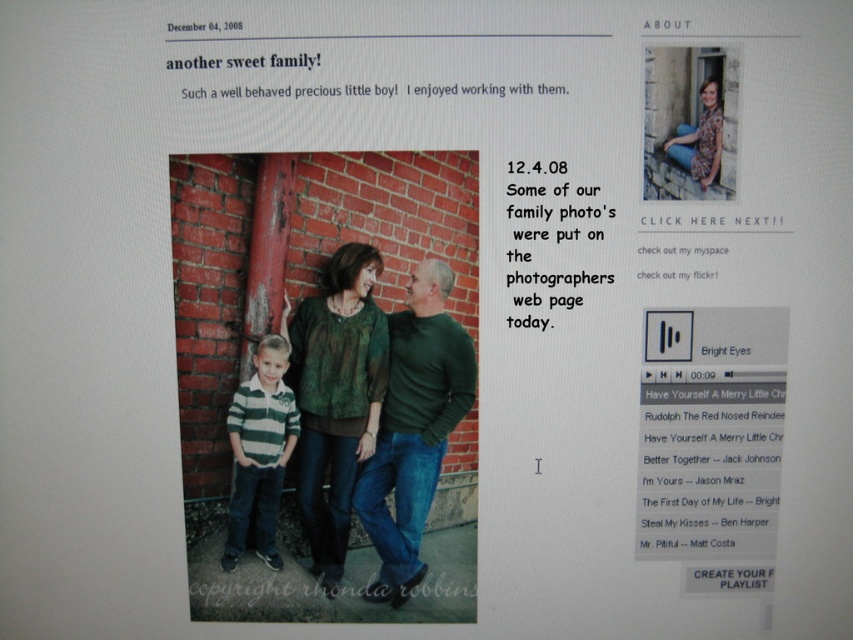
Question: Is green striped polo shirt at lower left below floral shirt at upper right?

Choices:
 (A) yes
 (B) no

Answer: (A)

Question: Based on their relative distances, which object is nearer to the green sweater at center?

Choices:
 (A) green textured blouse at center
 (B) floral shirt at upper right
 (C) green striped polo shirt at lower left
 (D) green textured sweater at center

Answer: (A)

Question: Which of the following is the closest to the observer?

Choices:
 (A) green striped polo shirt at lower left
 (B) floral shirt at upper right

Answer: (B)

Question: Which point is farther to the camera?

Choices:
 (A) green striped polo shirt at lower left
 (B) green textured sweater at center

Answer: (A)

Question: Is green textured blouse at center positioned before floral shirt at upper right?

Choices:
 (A) no
 (B) yes

Answer: (A)

Question: Is green textured blouse at center closer to the viewer compared to green striped polo shirt at lower left?

Choices:
 (A) no
 (B) yes

Answer: (B)